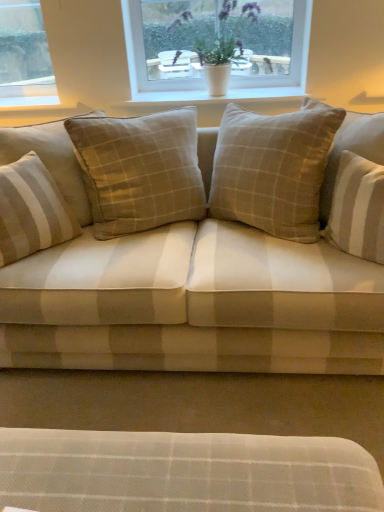
Question: Is white smooth window sill at upper center in front of or behind beige checkered pillow at center, which appears as the 1th pillow when viewed from the right, in the image?

Choices:
 (A) behind
 (B) front

Answer: (A)

Question: From a real-world perspective, relative to beige checkered pillow at center, which appears as the 1th pillow when viewed from the right, is white smooth window sill at upper center vertically above or below?

Choices:
 (A) below
 (B) above

Answer: (B)

Question: Based on their relative distances, which object is farther from the white smooth window sill at upper center?

Choices:
 (A) beige striped cushion at left, placed as the second pillow when sorted from right to left
 (B) beige checkered pillow at center, positioned as the 2th pillow in left-to-right order
 (C) beige plaid fabric couch at center
 (D) white plastic window at upper center

Answer: (A)

Question: Which is nearer to the beige checkered pillow at center, which appears as the 1th pillow when viewed from the right?

Choices:
 (A) beige plaid fabric couch at center
 (B) white plastic window at upper center
 (C) white smooth window sill at upper center
 (D) beige striped cushion at left, the first pillow positioned from the left

Answer: (A)